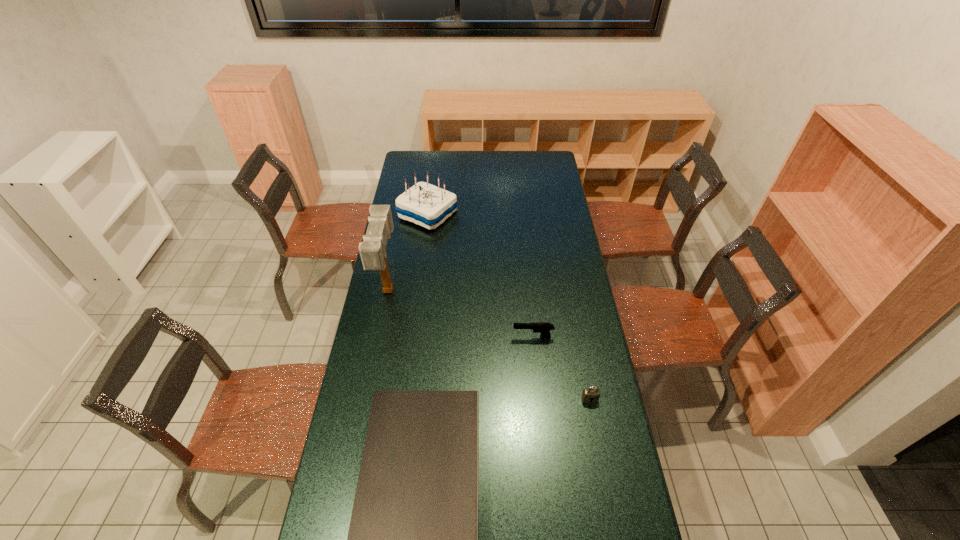
At what (x,y) coordinates should I click in order to perform the action: click on free space that satisfies the following two spatial constraints: 1. on the back side of the fourth nearest object; 2. on the left side of the farthest object. Please return your answer as a coordinate pair (x, y). This screenshot has height=540, width=960. Looking at the image, I should click on (403, 215).

I want to click on free space in the image that satisfies the following two spatial constraints: 1. on the back side of the birthday cake; 2. on the right side of the mallet, so click(403, 215).